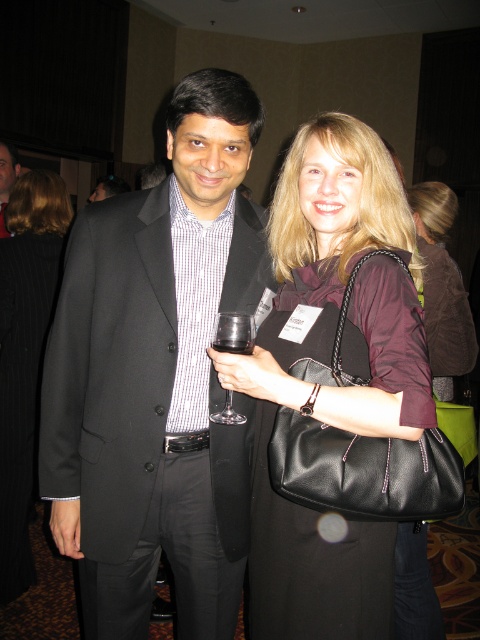
From the picture: You are a photographer at the event and need to adjust the camera focus. Since the black matte suit at center and the clear glass wine at center are in the same frame, which object should you focus on first if you want to ensure the taller object is in focus?

The black matte suit at center should be focused on first because it is taller than the clear glass wine at center.

You are a photographer standing 1.5 meters away from the camera. You want to take a photo of the black matte suit at center. Can you reach it without moving closer?

The black matte suit at center is 1.14 meters from the camera. Since you are 1.5 meters away from the camera, you are farther than the subject. To capture the black matte suit at center in your photo, you would need to move closer to the camera so that the distance between you and the subject is within your reach or adjust your camera settings to include the subject from your current position.

You are standing in the center of the room and want to move towards the nearest of the two points, point (257, 292) and point (12, 180). Which point should you walk towards?

Point (257, 292) is closer to the viewer than point (12, 180), so you should walk towards point (257, 292).